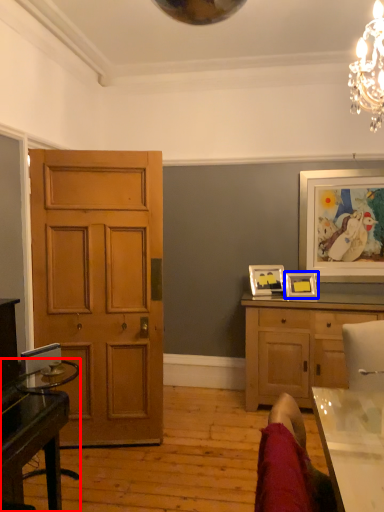
Question: Which object appears farthest to the camera in this image, desk (highlighted by a red box) or picture frame (highlighted by a blue box)?

Choices:
 (A) desk
 (B) picture frame

Answer: (B)